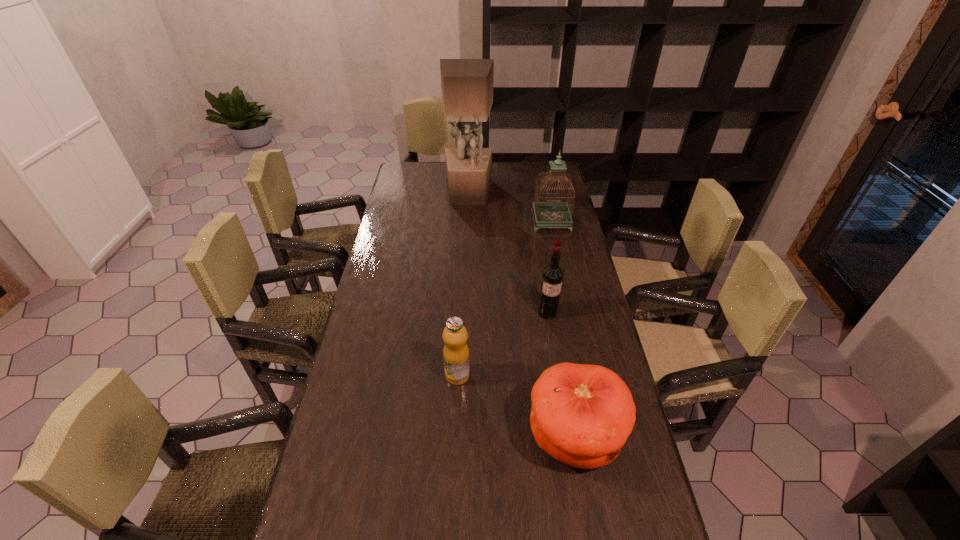
Identify the location of free space between the sculpture and the fruit juice. (463, 284).

The height and width of the screenshot is (540, 960). I want to click on free space between the fruit juice and the third farthest object, so click(502, 344).

Find the location of a particular element. The image size is (960, 540). vacant space in between the third nearest object and the tallest object is located at coordinates (508, 253).

This screenshot has width=960, height=540. In order to click on vacant point located between the pumpkin and the birdcage in this screenshot , I will do `click(563, 328)`.

Where is `blank region between the wine bottle and the fruit juice`? This screenshot has height=540, width=960. blank region between the wine bottle and the fruit juice is located at coordinates (502, 344).

The width and height of the screenshot is (960, 540). What are the coordinates of `free space between the fruit juice and the sculpture` in the screenshot? It's located at (463, 284).

Point out which object is positioned as the fourth nearest to the pumpkin. Please provide its 2D coordinates. Your answer should be formatted as a tuple, i.e. [(x, y)], where the tuple contains the x and y coordinates of a point satisfying the conditions above.

[(467, 84)]

Identify the location of the closest object to the third nearest object. Image resolution: width=960 pixels, height=540 pixels. 581,415.

The height and width of the screenshot is (540, 960). I want to click on vacant space that satisfies the following two spatial constraints: 1. on the front label of the nearest object; 2. on the left side of the second nearest object, so click(x=455, y=436).

I want to click on free space that satisfies the following two spatial constraints: 1. on the front-facing side of the farthest object; 2. on the right side of the nearest object, so click(460, 436).